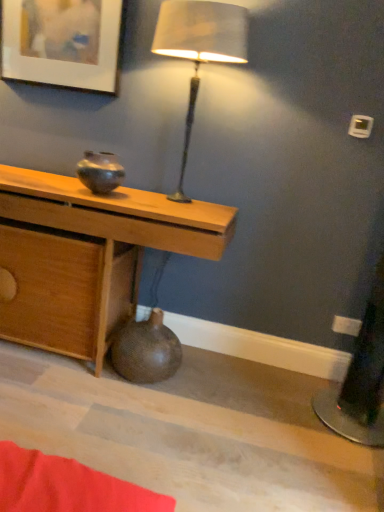
Locate an element on the screen. This screenshot has height=512, width=384. free spot to the left of shiny metallic vase at center, placed as the first vase when sorted from top to bottom is located at coordinates (50, 186).